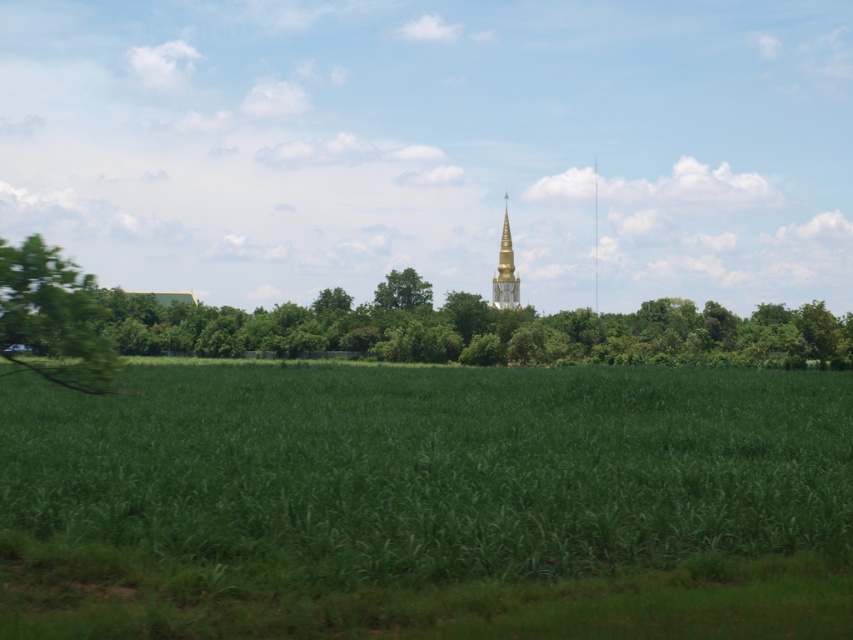
Is green grass at center to the left of gold metallic spire at center from the viewer's perspective?

Indeed, green grass at center is positioned on the left side of gold metallic spire at center.

Does green grass at center have a greater height compared to gold metallic spire at center?

No, green grass at center is not taller than gold metallic spire at center.

Locate an element on the screen. The image size is (853, 640). green grass at center is located at coordinates (427, 502).

Image resolution: width=853 pixels, height=640 pixels. In order to click on green grass at center in this screenshot , I will do `click(427, 502)`.

Is green leafy tree at left further to the viewer compared to gold metallic spire at center?

No, it is not.

Is the position of green leafy tree at left less distant than that of gold metallic spire at center?

Yes, it is.

What do you see at coordinates (51, 317) in the screenshot? I see `green leafy tree at left` at bounding box center [51, 317].

I want to click on green leafy tree at left, so click(51, 317).

Does green grass at center have a smaller size compared to green leafy tree at left?

Incorrect, green grass at center is not smaller in size than green leafy tree at left.

Who is shorter, green grass at center or green leafy tree at left?

With less height is green grass at center.

Does point (136, 547) lie in front of point (91, 284)?

That is False.

Where is `green grass at center`? green grass at center is located at coordinates (427, 502).